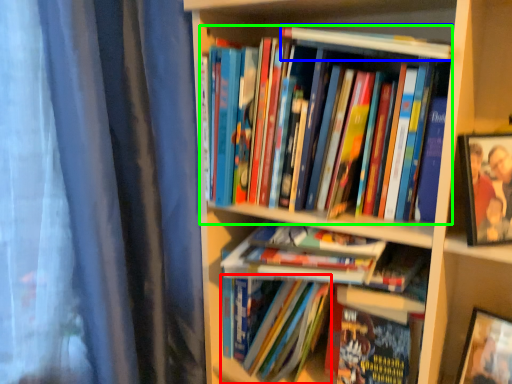
Question: Which is nearer to the book (highlighted by a red box)? book (highlighted by a blue box) or book (highlighted by a green box).

Choices:
 (A) book
 (B) book

Answer: (B)